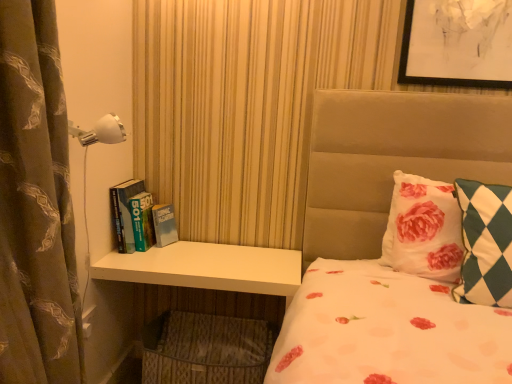
I want to click on free space below green matte book at left (from a real-world perspective), so click(146, 252).